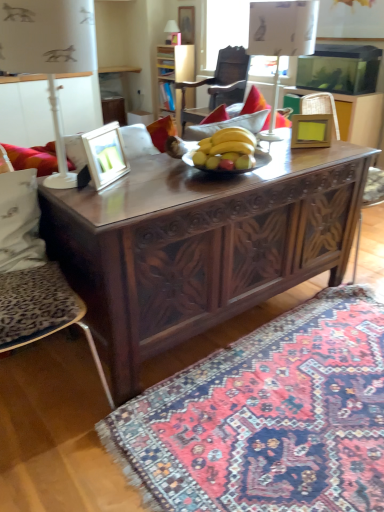
Where is `vacant area that lies in front of white plastic lamp at left, placed as the 3th lamp when sorted from back to front`? vacant area that lies in front of white plastic lamp at left, placed as the 3th lamp when sorted from back to front is located at coordinates (101, 203).